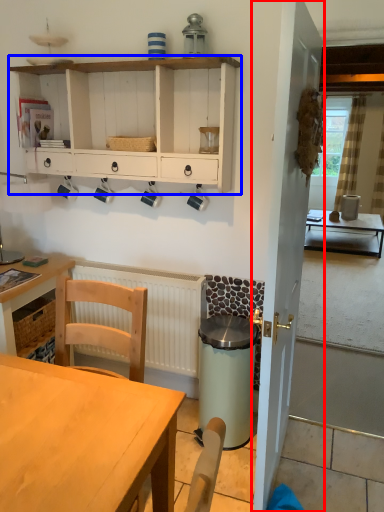
Question: Which object is closer to the camera taking this photo, door (highlighted by a red box) or cabinetry (highlighted by a blue box)?

Choices:
 (A) door
 (B) cabinetry

Answer: (A)